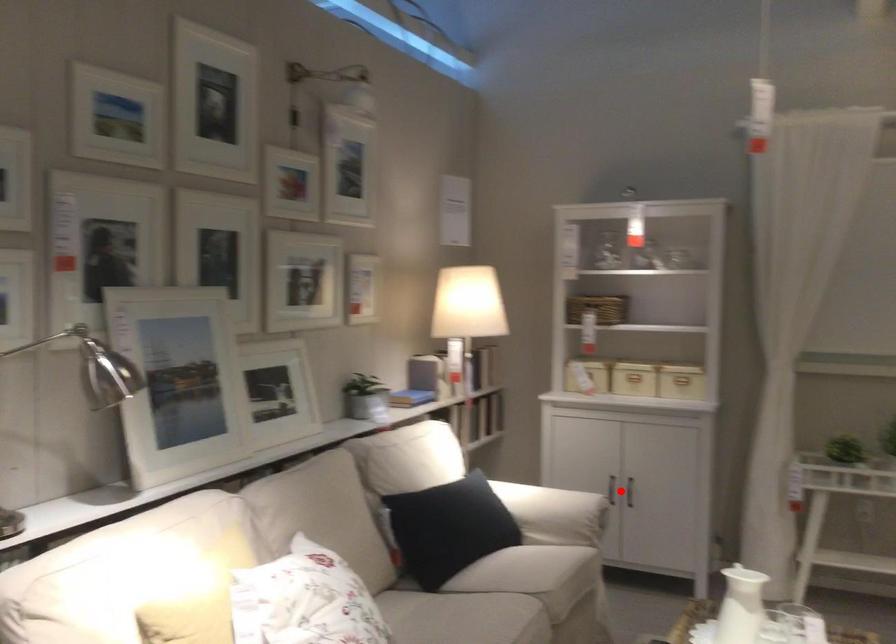
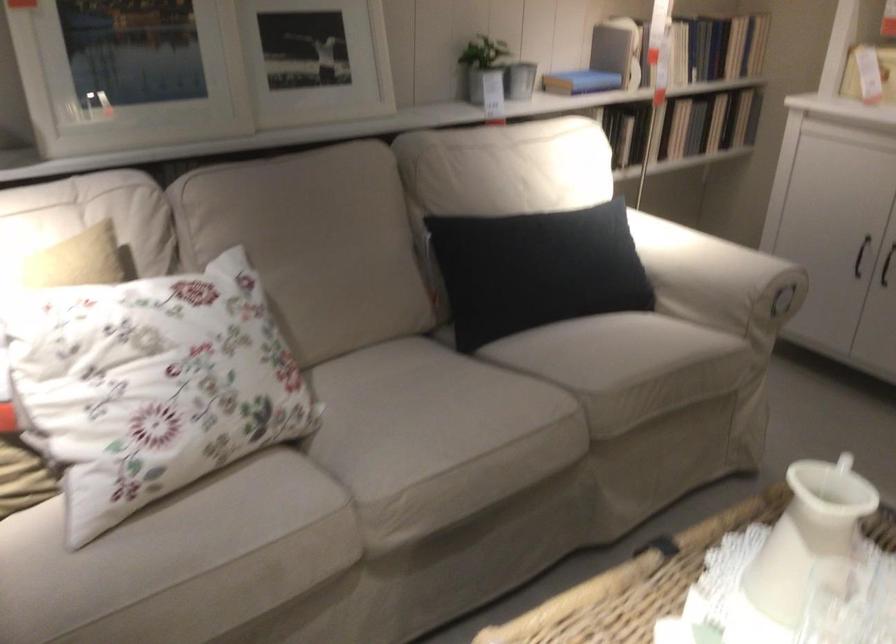
Question: I am providing you with two images of the same scene from different viewpoints. Given a red point in image1, look at the same physical point in image2. Is it:

Choices:
 (A) Closer to the viewpoint
 (B) Farther from the viewpoint

Answer: (A)